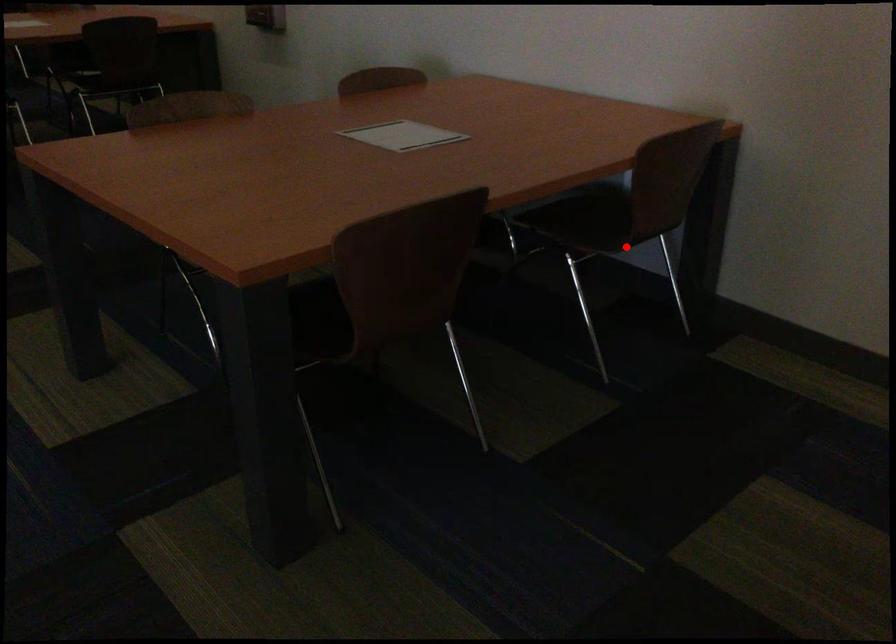
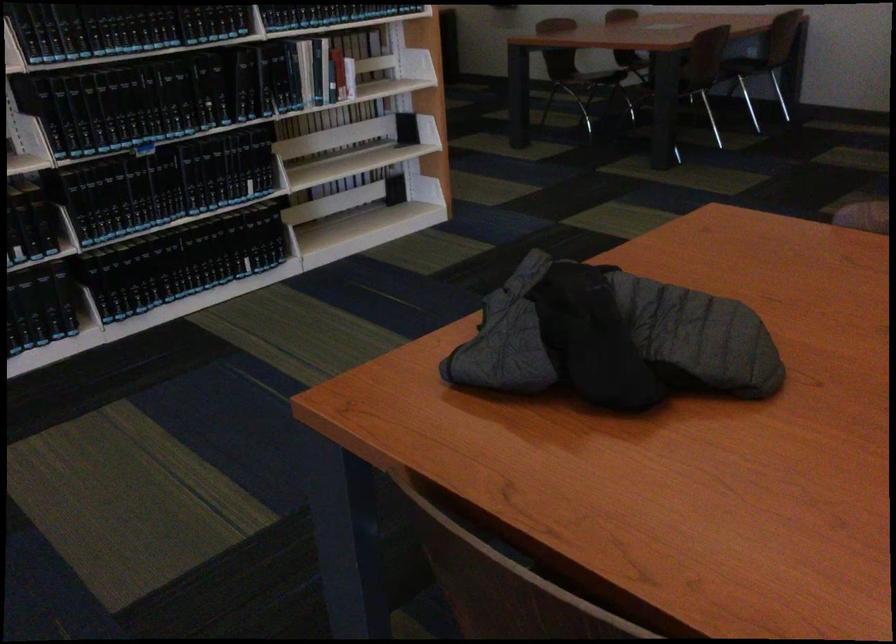
Where in the second image is the point corresponding to the highlighted location from the first image?

(743, 58)